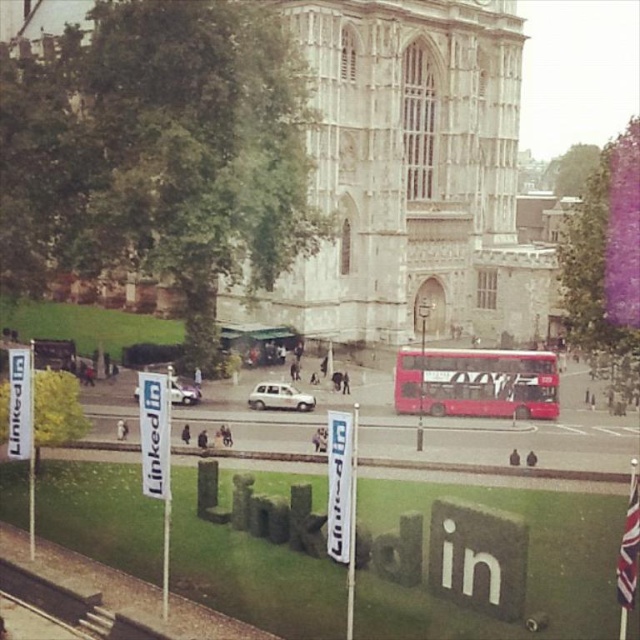
Question: Which object is closer to the camera taking this photo?

Choices:
 (A) red matte double-decker bus at center
 (B) silver metallic van at center
 (C) white matte car at center

Answer: (B)

Question: Which of these objects is positioned farthest from the silver metallic van at center?

Choices:
 (A) red matte double-decker bus at center
 (B) white matte car at center

Answer: (A)

Question: Can you confirm if red matte double-decker bus at center is thinner than silver metallic van at center?

Choices:
 (A) no
 (B) yes

Answer: (A)

Question: Does white matte car at center have a smaller size compared to silver metallic van at center?

Choices:
 (A) yes
 (B) no

Answer: (A)

Question: Which of the following is the closest to the observer?

Choices:
 (A) (522, 381)
 (B) (173, 376)

Answer: (A)

Question: Does red matte double-decker bus at center appear over silver metallic van at center?

Choices:
 (A) no
 (B) yes

Answer: (B)